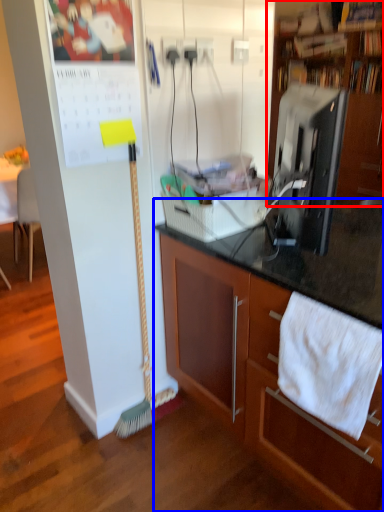
Question: Which point is closer to the camera, cabinetry (highlighted by a red box) or cabinetry (highlighted by a blue box)?

Choices:
 (A) cabinetry
 (B) cabinetry

Answer: (B)